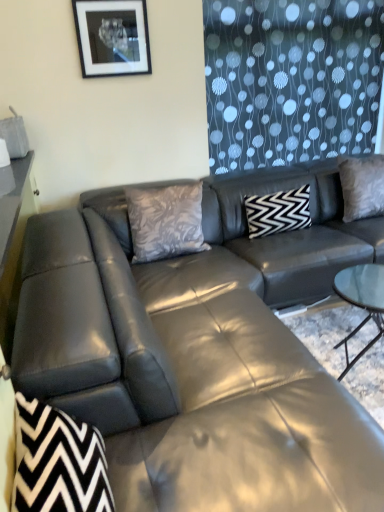
Question: In which direction should I rotate to look at silky gray pillow at center, arranged as the third pillow when viewed from the right?

Choices:
 (A) right
 (B) left

Answer: (B)

Question: From the image's perspective, does matte black leather couch at center appear higher than matte black picture frame at upper center?

Choices:
 (A) no
 (B) yes

Answer: (A)

Question: Is matte black leather couch at center in front of matte black picture frame at upper center?

Choices:
 (A) yes
 (B) no

Answer: (A)

Question: Is matte black leather couch at center to the right of matte black picture frame at upper center from the viewer's perspective?

Choices:
 (A) yes
 (B) no

Answer: (A)

Question: From a real-world perspective, is matte black leather couch at center under matte black picture frame at upper center?

Choices:
 (A) no
 (B) yes

Answer: (B)

Question: Is matte black leather couch at center far from matte black picture frame at upper center?

Choices:
 (A) no
 (B) yes

Answer: (B)

Question: Could matte black picture frame at upper center be considered to be inside matte black leather couch at center?

Choices:
 (A) no
 (B) yes

Answer: (A)

Question: Considering the relative positions of black zigzag fabric swivel chair at lower left and matte black picture frame at upper center in the image provided, is black zigzag fabric swivel chair at lower left behind matte black picture frame at upper center?

Choices:
 (A) yes
 (B) no

Answer: (B)

Question: Does black zigzag fabric swivel chair at lower left have a smaller size compared to matte black picture frame at upper center?

Choices:
 (A) no
 (B) yes

Answer: (A)

Question: Is black zigzag fabric swivel chair at lower left in contact with matte black picture frame at upper center?

Choices:
 (A) yes
 (B) no

Answer: (B)

Question: Considering the relative sizes of black zigzag fabric swivel chair at lower left and matte black picture frame at upper center in the image provided, is black zigzag fabric swivel chair at lower left wider than matte black picture frame at upper center?

Choices:
 (A) yes
 (B) no

Answer: (A)

Question: Is black zigzag fabric swivel chair at lower left outside of matte black picture frame at upper center?

Choices:
 (A) no
 (B) yes

Answer: (B)

Question: Is black zigzag fabric swivel chair at lower left to the left of matte black picture frame at upper center from the viewer's perspective?

Choices:
 (A) yes
 (B) no

Answer: (B)

Question: Does silky gray pillow at upper right, the 1th pillow positioned from the right, have a lesser height compared to black zigzag fabric swivel chair at lower left?

Choices:
 (A) no
 (B) yes

Answer: (A)